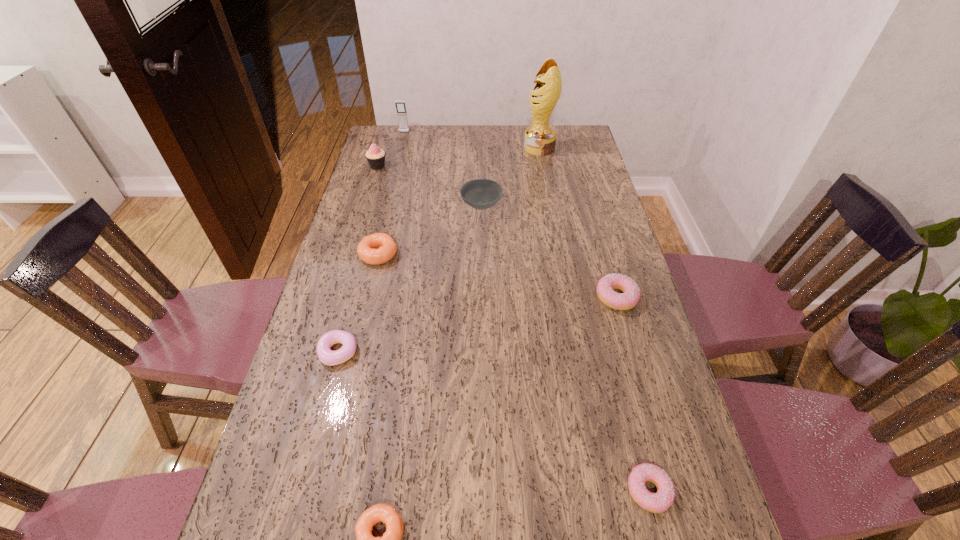
Where is `the bigger pink doughnut`? Image resolution: width=960 pixels, height=540 pixels. the bigger pink doughnut is located at coordinates (629, 298).

This screenshot has width=960, height=540. What are the coordinates of `the sixth farthest object` in the screenshot? It's located at (629, 298).

The width and height of the screenshot is (960, 540). I want to click on purple doughnut, so click(328, 357).

At what (x,y) coordinates should I click in order to perform the action: click on the seventh farthest object. Please return your answer as a coordinate pair (x, y). Image resolution: width=960 pixels, height=540 pixels. Looking at the image, I should click on (328, 357).

Locate an element on the screen. Image resolution: width=960 pixels, height=540 pixels. the nearer pink doughnut is located at coordinates (658, 502).

Locate an element on the screen. Image resolution: width=960 pixels, height=540 pixels. free space located 0.190m on the front-facing side of the second farthest object is located at coordinates (477, 147).

You are a GUI agent. You are given a task and a screenshot of the screen. Output one action in this format:
    pyautogui.click(x=<x>, y=<y>)
    Task: Click on the vacant area situated 0.070m on the front-facing side of the second farthest object
    
    Given the screenshot: What is the action you would take?
    pyautogui.click(x=507, y=147)

I want to click on free point located on the front-facing side of the second farthest object, so click(492, 147).

Find the location of a particular element. free region located on the front-facing side of the farthest object is located at coordinates (400, 148).

The width and height of the screenshot is (960, 540). In order to click on vacant space located 0.220m on the front of the seventh shortest object in this screenshot , I will do `click(366, 207)`.